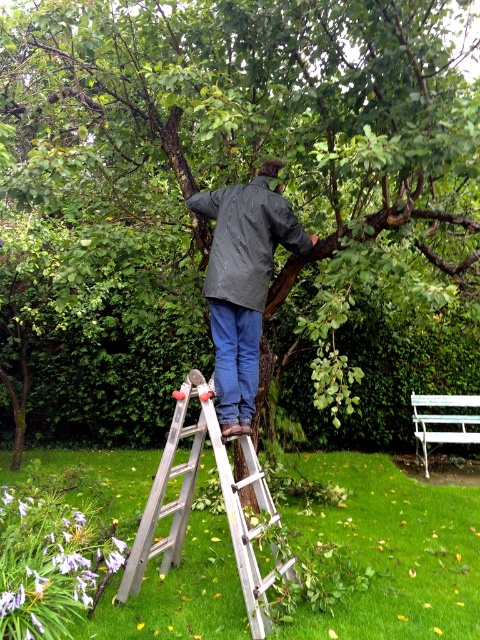
Is silver metallic ladder at center behind white painted wood park bench at lower right?

No, it is not.

Is silver metallic ladder at center above white painted wood park bench at lower right?

Yes.

The height and width of the screenshot is (640, 480). Describe the element at coordinates (191, 506) in the screenshot. I see `silver metallic ladder at center` at that location.

At what (x,y) coordinates should I click in order to perform the action: click on silver metallic ladder at center. Please return your answer as a coordinate pair (x, y). This screenshot has width=480, height=640. Looking at the image, I should click on (191, 506).

Between green rough bark tree at upper center and dark gray jacket at center, which one appears on the right side from the viewer's perspective?

green rough bark tree at upper center is more to the right.

Locate an element on the screen. green rough bark tree at upper center is located at coordinates (228, 188).

Can you confirm if green rough bark tree at upper center is positioned to the left of silver metallic ladder at center?

No, green rough bark tree at upper center is not to the left of silver metallic ladder at center.

Based on the photo, does green rough bark tree at upper center have a lesser height compared to silver metallic ladder at center?

Indeed, green rough bark tree at upper center has a lesser height compared to silver metallic ladder at center.

Find the location of a particular element. The image size is (480, 640). green rough bark tree at upper center is located at coordinates (228, 188).